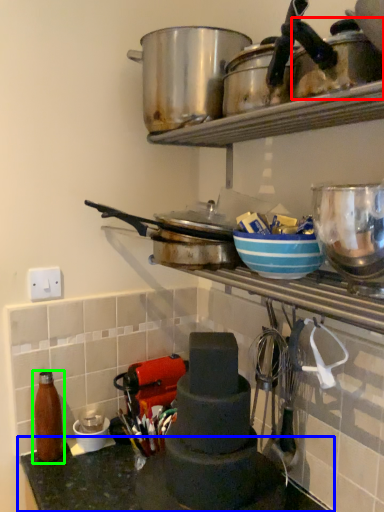
Question: Which is farther away from appliance (highlighted by a red box)? countertop (highlighted by a blue box) or bottle (highlighted by a green box)?

Choices:
 (A) countertop
 (B) bottle

Answer: (B)